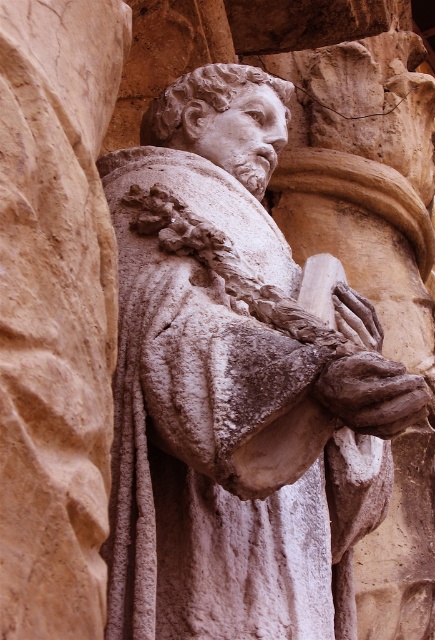
Question: Which object is farther from the camera taking this photo?

Choices:
 (A) brown stone hand at center
 (B) white stone head at center
 (C) white stone statue at center
 (D) smooth stone hand at center

Answer: (B)

Question: Is white stone head at center above brown stone hand at center?

Choices:
 (A) no
 (B) yes

Answer: (B)

Question: Is white stone head at center positioned at the back of brown stone hand at center?

Choices:
 (A) yes
 (B) no

Answer: (A)

Question: Can you confirm if white stone head at center is positioned below smooth stone hand at center?

Choices:
 (A) yes
 (B) no

Answer: (B)

Question: Which point is farther from the camera taking this photo?

Choices:
 (A) (364, 305)
 (B) (348, 365)
 (C) (221, 81)
 (D) (150, 108)

Answer: (D)

Question: Which point is farther from the camera taking this photo?

Choices:
 (A) (368, 403)
 (B) (278, 118)
 (C) (357, 312)

Answer: (B)